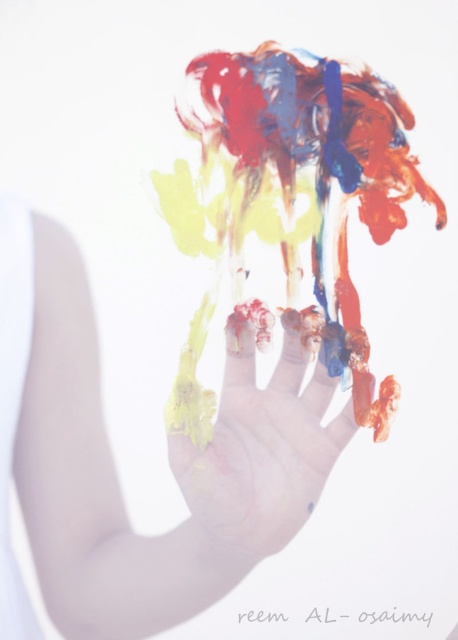
Question: Does painted hand at center appear under painted plastic hand at center?

Choices:
 (A) yes
 (B) no

Answer: (B)

Question: Does painted hand at center have a lesser width compared to painted plastic hand at center?

Choices:
 (A) yes
 (B) no

Answer: (B)

Question: Does painted hand at center appear on the left side of painted plastic hand at center?

Choices:
 (A) yes
 (B) no

Answer: (A)